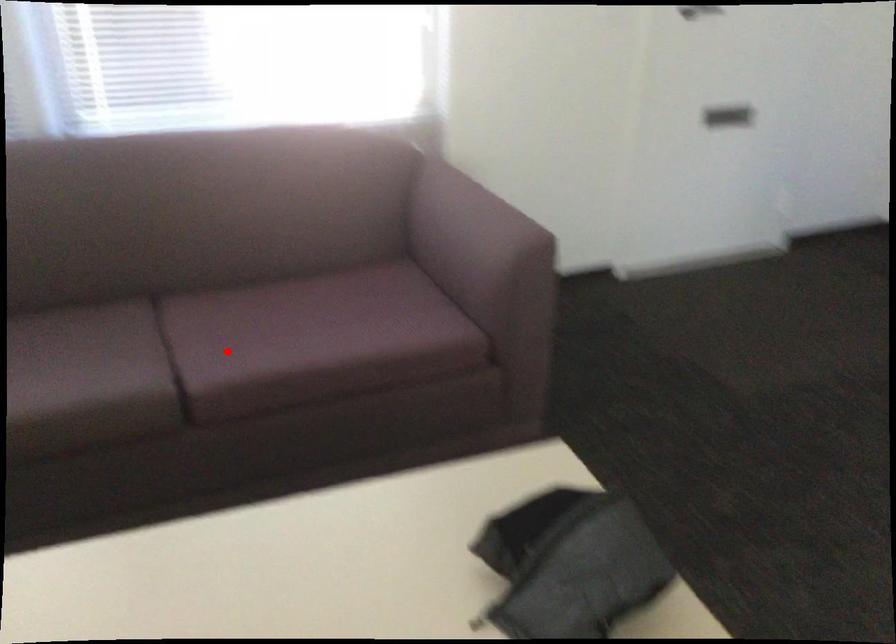
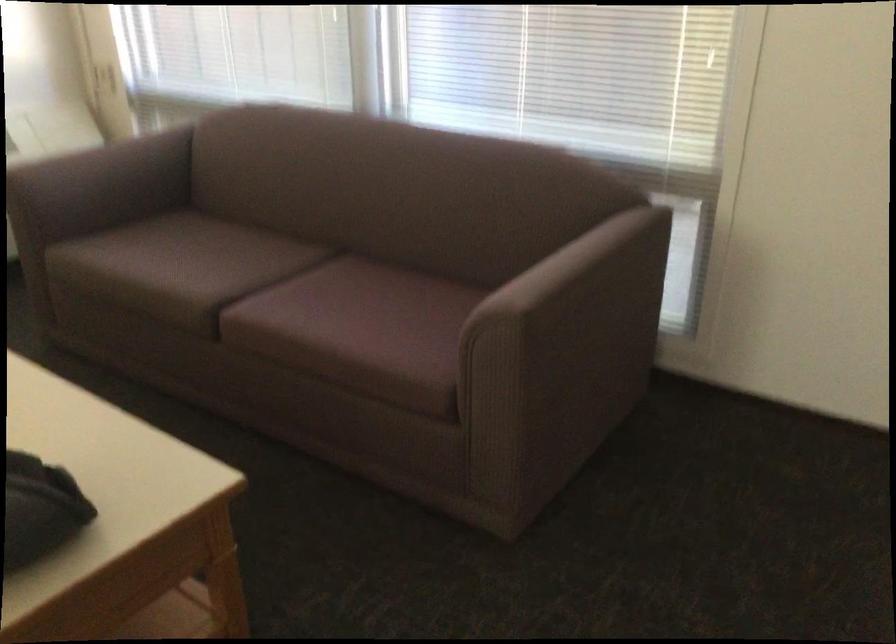
Question: A red point is marked in image1. In image2, is the corresponding 3D point closer to the camera or farther? Reply with the corresponding letter.

Choices:
 (A) The corresponding 3D point is closer.
 (B) The corresponding 3D point is farther.

Answer: (B)